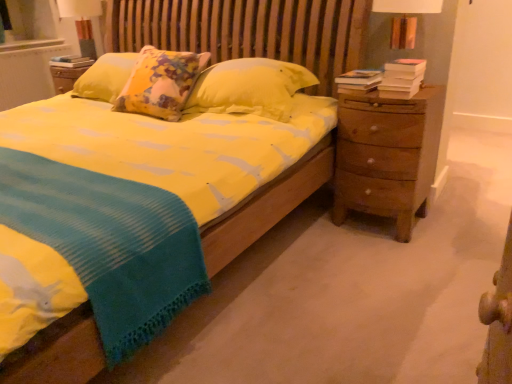
Find the location of a particular element. free spot above white textured radiator at upper left (from a real-world perspective) is located at coordinates (27, 41).